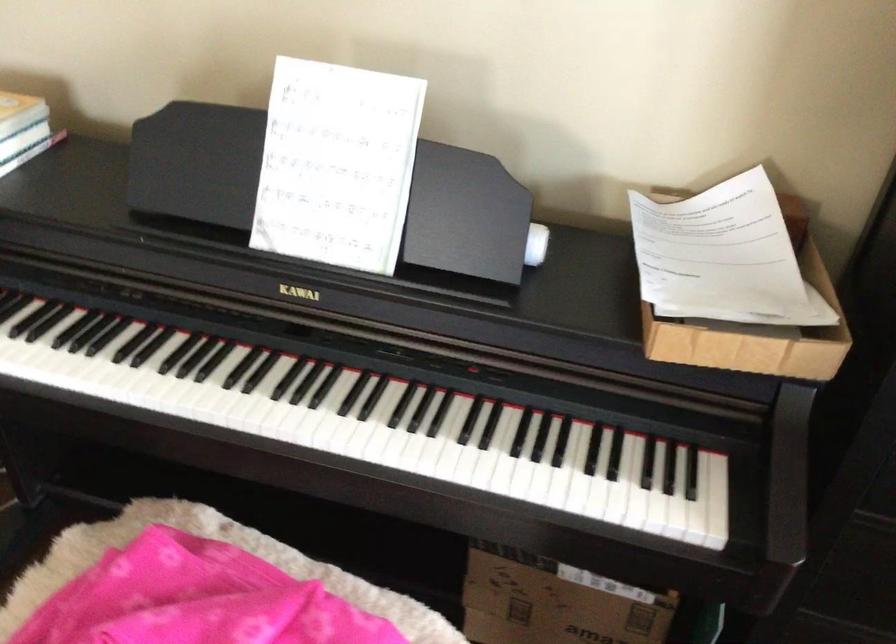
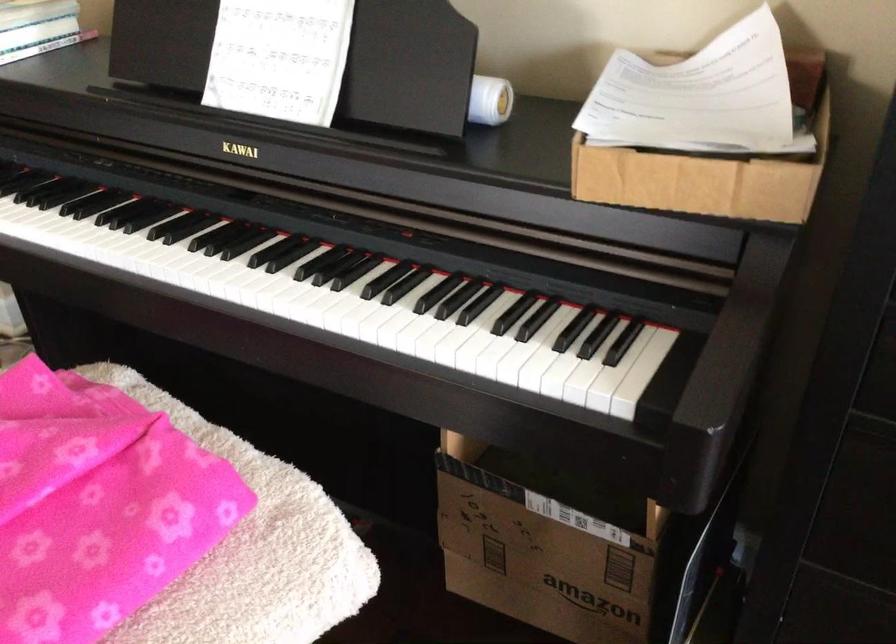
Question: The first image is from the beginning of the video and the second image is from the end. How did the camera likely rotate when shooting the video?

Choices:
 (A) Left
 (B) Right
 (C) Up
 (D) Down

Answer: (A)